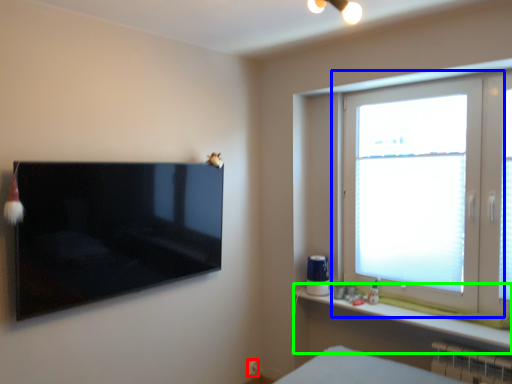
Question: Which object is positioned farthest from electric outlet (highlighted by a red box)? Select from window (highlighted by a blue box) and window sill (highlighted by a green box).

Choices:
 (A) window
 (B) window sill

Answer: (A)